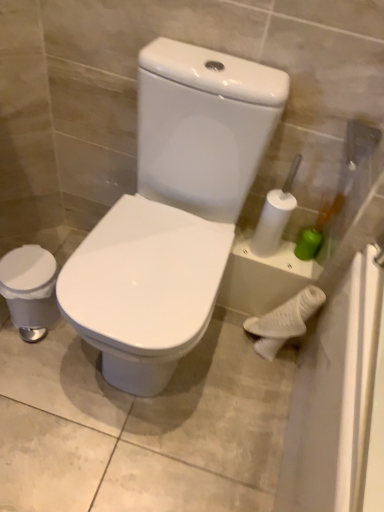
Question: Would you say white matte porcelain at lower right, marked as the 3th porcelain in a left-to-right arrangement, is a long distance from white glossy toilet at center, placed as the second porcelain when sorted from left to right?

Choices:
 (A) yes
 (B) no

Answer: (B)

Question: Is the depth of white matte porcelain at lower right, marked as the 3th porcelain in a left-to-right arrangement, less than that of white glossy toilet at center, placed as the second porcelain when sorted from left to right?

Choices:
 (A) no
 (B) yes

Answer: (A)

Question: Does white matte porcelain at lower right, marked as the 3th porcelain in a left-to-right arrangement, have a lesser width compared to white glossy toilet at center, placed as the second porcelain when sorted from left to right?

Choices:
 (A) no
 (B) yes

Answer: (B)

Question: From a real-world perspective, is white matte porcelain at lower right, marked as the 3th porcelain in a left-to-right arrangement, below white glossy toilet at center, arranged as the 2th porcelain when viewed from the right?

Choices:
 (A) yes
 (B) no

Answer: (A)

Question: From the image's perspective, is white matte porcelain at lower right, acting as the 1th porcelain starting from the right, beneath white glossy toilet at center, placed as the second porcelain when sorted from left to right?

Choices:
 (A) yes
 (B) no

Answer: (A)

Question: From a real-world perspective, is white matte porcelain at lower right, acting as the 1th porcelain starting from the right, on top of white glossy toilet at center, arranged as the 2th porcelain when viewed from the right?

Choices:
 (A) yes
 (B) no

Answer: (B)

Question: Could you tell me if white glossy trash can at left, the 1th porcelain in the left-to-right sequence, is facing white matte porcelain at lower right, marked as the 3th porcelain in a left-to-right arrangement?

Choices:
 (A) yes
 (B) no

Answer: (B)

Question: From a real-world perspective, is white glossy trash can at left, arranged as the 3th porcelain when viewed from the right, positioned over white matte porcelain at lower right, marked as the 3th porcelain in a left-to-right arrangement, based on gravity?

Choices:
 (A) no
 (B) yes

Answer: (A)

Question: Considering the relative sizes of white glossy trash can at left, arranged as the 3th porcelain when viewed from the right, and white matte porcelain at lower right, marked as the 3th porcelain in a left-to-right arrangement, in the image provided, is white glossy trash can at left, arranged as the 3th porcelain when viewed from the right, smaller than white matte porcelain at lower right, marked as the 3th porcelain in a left-to-right arrangement,?

Choices:
 (A) no
 (B) yes

Answer: (A)

Question: Is white glossy trash can at left, the 1th porcelain in the left-to-right sequence, not near white matte porcelain at lower right, marked as the 3th porcelain in a left-to-right arrangement?

Choices:
 (A) yes
 (B) no

Answer: (B)

Question: Can you confirm if white glossy trash can at left, the 1th porcelain in the left-to-right sequence, is shorter than white matte porcelain at lower right, marked as the 3th porcelain in a left-to-right arrangement?

Choices:
 (A) no
 (B) yes

Answer: (B)

Question: From a real-world perspective, does white glossy trash can at left, the 1th porcelain in the left-to-right sequence, sit lower than white matte porcelain at lower right, acting as the 1th porcelain starting from the right?

Choices:
 (A) yes
 (B) no

Answer: (A)

Question: From a real-world perspective, is white glossy trash can at left, arranged as the 3th porcelain when viewed from the right, on white glossy toilet at center, arranged as the 2th porcelain when viewed from the right?

Choices:
 (A) yes
 (B) no

Answer: (B)